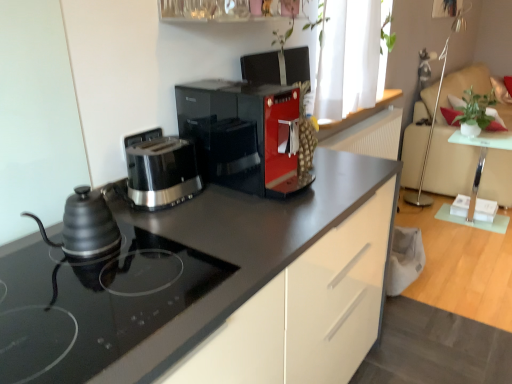
Question: Considering the relative positions of clear glass table at right and black matte kettle at left in the image provided, is clear glass table at right to the right of black matte kettle at left from the viewer's perspective?

Choices:
 (A) yes
 (B) no

Answer: (A)

Question: Is clear glass table at right facing towards black matte kettle at left?

Choices:
 (A) no
 (B) yes

Answer: (A)

Question: Is the position of clear glass table at right less distant than that of black matte kettle at left?

Choices:
 (A) no
 (B) yes

Answer: (A)

Question: Considering the relative sizes of clear glass table at right and black matte kettle at left in the image provided, is clear glass table at right wider than black matte kettle at left?

Choices:
 (A) yes
 (B) no

Answer: (A)

Question: Does clear glass table at right lie behind black matte kettle at left?

Choices:
 (A) yes
 (B) no

Answer: (A)

Question: Choose the correct answer: Is matte black kettle at left inside white fabric chair at right or outside it?

Choices:
 (A) inside
 (B) outside

Answer: (B)

Question: Is matte black kettle at left taller or shorter than white fabric chair at right?

Choices:
 (A) tall
 (B) short

Answer: (B)

Question: From the image's perspective, is matte black kettle at left above or below white fabric chair at right?

Choices:
 (A) above
 (B) below

Answer: (B)

Question: Relative to white fabric chair at right, is matte black kettle at left in front or behind?

Choices:
 (A) front
 (B) behind

Answer: (A)

Question: Is matte black kettle at left inside or outside of clear glass shelf at upper center?

Choices:
 (A) inside
 (B) outside

Answer: (B)

Question: In terms of size, does matte black kettle at left appear bigger or smaller than clear glass shelf at upper center?

Choices:
 (A) small
 (B) big

Answer: (A)

Question: From a real-world perspective, is matte black kettle at left above or below clear glass shelf at upper center?

Choices:
 (A) above
 (B) below

Answer: (B)

Question: Is matte black kettle at left in front of or behind clear glass shelf at upper center in the image?

Choices:
 (A) front
 (B) behind

Answer: (A)

Question: Is matte black coffee maker at center in front of or behind black matte kettle at left in the image?

Choices:
 (A) behind
 (B) front

Answer: (A)

Question: Considering the relative positions of matte black coffee maker at center and black matte kettle at left in the image provided, is matte black coffee maker at center to the left or to the right of black matte kettle at left?

Choices:
 (A) right
 (B) left

Answer: (A)